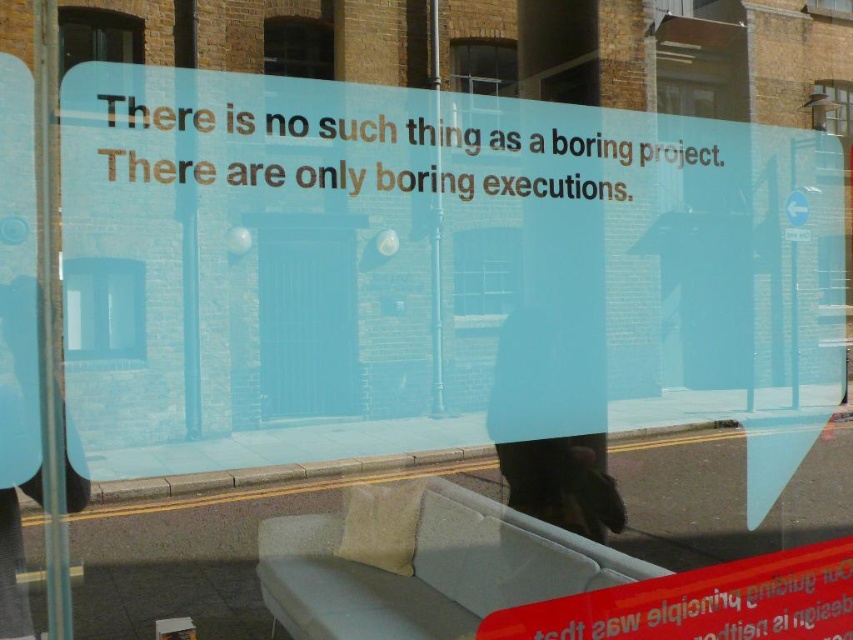
Question: Can you confirm if dark glass window at upper left is positioned below matte glass window at upper center?

Choices:
 (A) yes
 (B) no

Answer: (A)

Question: Which of the following is the farthest from the observer?

Choices:
 (A) dark glass window at upper left
 (B) clear glass window at center
 (C) transparent glass window at upper right

Answer: (C)

Question: Considering the real-world distances, which object is closest to the matte glass window at upper center?

Choices:
 (A) transparent glass window at upper center
 (B) transparent glass window at center

Answer: (A)

Question: Does clear glass window at center have a smaller size compared to transparent glass window at upper center?

Choices:
 (A) no
 (B) yes

Answer: (A)

Question: Estimate the real-world distances between objects in this image. Which object is farther from the transparent glass window at upper center?

Choices:
 (A) dark glass window at upper left
 (B) transparent glass window at center
 (C) matte glass window at upper center
 (D) transparent glass window at upper right

Answer: (D)

Question: Does transparent glass window at center have a larger size compared to dark glass window at upper left?

Choices:
 (A) yes
 (B) no

Answer: (A)